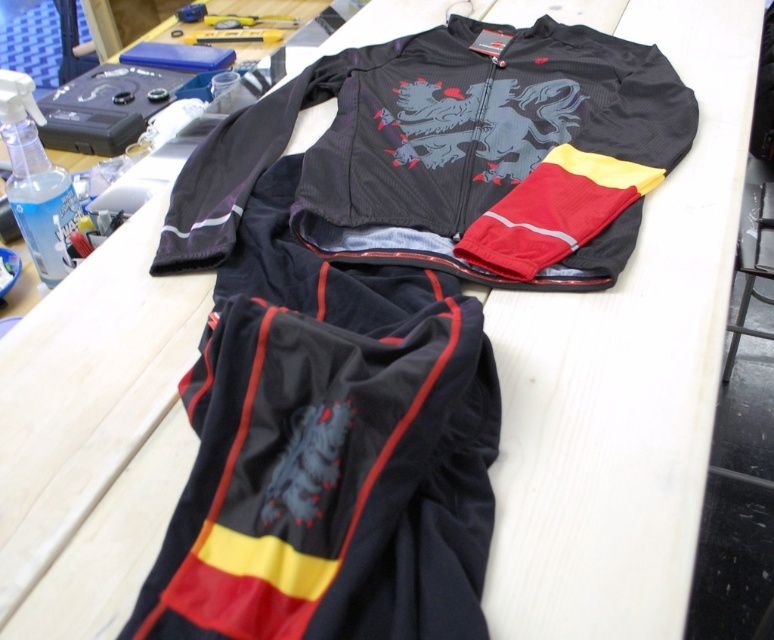
Question: Which of the following is the closest to the observer?

Choices:
 (A) (478, 88)
 (B) (259, 412)

Answer: (B)

Question: Considering the relative positions of black matte cycling suit at center and matte black jacket at center in the image provided, where is black matte cycling suit at center located with respect to matte black jacket at center?

Choices:
 (A) right
 (B) left

Answer: (B)

Question: Which of the following is the farthest from the observer?

Choices:
 (A) (548, 269)
 (B) (225, 410)

Answer: (A)

Question: Can you confirm if black matte cycling suit at center is bigger than matte black jacket at center?

Choices:
 (A) no
 (B) yes

Answer: (A)

Question: Which of the following is the farthest from the observer?

Choices:
 (A) matte black jacket at center
 (B) black matte cycling suit at center

Answer: (A)

Question: Can you confirm if black matte cycling suit at center is wider than matte black jacket at center?

Choices:
 (A) no
 (B) yes

Answer: (A)